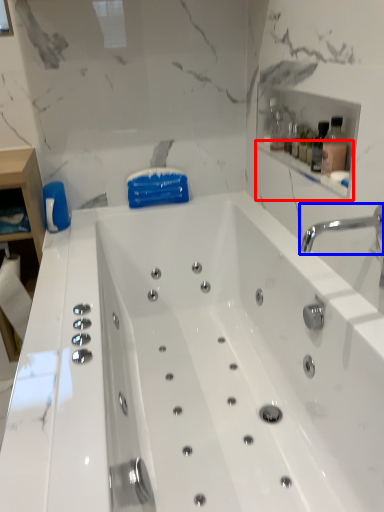
Question: Among these objects, which one is nearest to the camera, balustrade (highlighted by a red box) or tap (highlighted by a blue box)?

Choices:
 (A) balustrade
 (B) tap

Answer: (B)